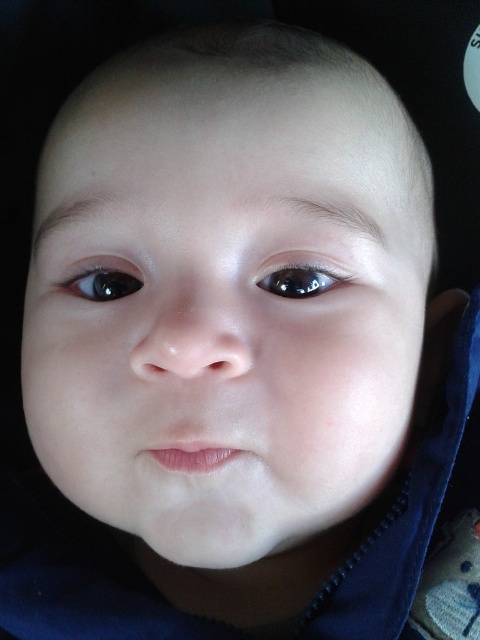
Question: Is black glossy eye at upper left further to camera compared to glossy black eye at upper center?

Choices:
 (A) yes
 (B) no

Answer: (A)

Question: Which point is farther to the camera?

Choices:
 (A) (121, 282)
 (B) (278, 285)

Answer: (A)

Question: Does black glossy eye at upper left have a greater width compared to glossy black eye at upper center?

Choices:
 (A) yes
 (B) no

Answer: (B)

Question: Can you confirm if black glossy eye at upper left is positioned below glossy black eye at upper center?

Choices:
 (A) yes
 (B) no

Answer: (B)

Question: Which point appears closest to the camera in this image?

Choices:
 (A) [x=288, y=285]
 (B) [x=117, y=285]

Answer: (A)